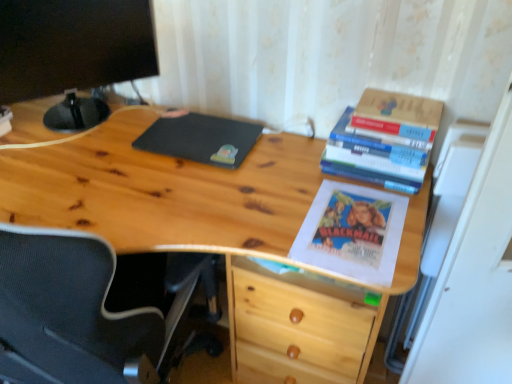
At what (x,y) coordinates should I click in order to perform the action: click on free location to the left of hardcover books at upper right, acting as the 2th book starting from the top. Please return your answer as a coordinate pair (x, y). Looking at the image, I should click on (298, 173).